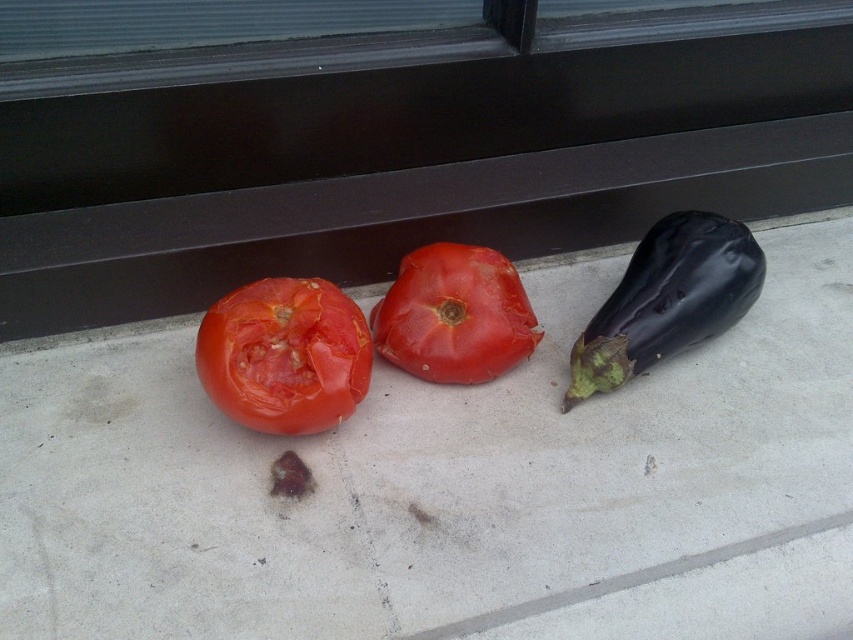
You are a grocery store employee tasked with arranging vegetables. You have a narrow shelf space that can only accommodate vegetables no wider than 5 cm. You need to place both the shiny red tomato at center and the shiny dark purple eggplant at right on this shelf. Based on their widths, which vegetable should you place first to ensure they both fit?

The shiny red tomato at center is thinner than the shiny dark purple eggplant at right. Since the shelf can only hold vegetables no wider than 5 cm, you should first place the shiny red tomato at center because it is thinner and more likely to fit within the width constraint. Then, check if the eggplant also fits, but prioritize the tomato due to its smaller width.

You are a grocery inspector standing at the point marked as point (283, 355). You need to check the tomatoes on the left and right. Which tomato is more likely to be overripe?

The shiny red tomato at center is at point (283, 355). The tomato on the left has a bite taken out of it and wrinkled skin, indicating damage and possible lack of freshness. The tomato on the right is the black eggplant, which is a different vegetable. Wait, the objects listed are only the point and the eggplant? Let me check again. The user provided Objects as point and eggplant? Hmm, maybe there was a mistake. The original scene mentions three vegetables but the Objects list only has the point and eggp?

You are standing at the origin point of the coordinate system where the window is at the top edge. You want to pick the shiny red tomato at center. Which direction should you move towards based on its coordinates?

The shiny red tomato at center is located at coordinates point (283, 355). Since the window is at the top edge, moving towards the right and slightly upwards from the origin point would lead you to the shiny red tomato at center.